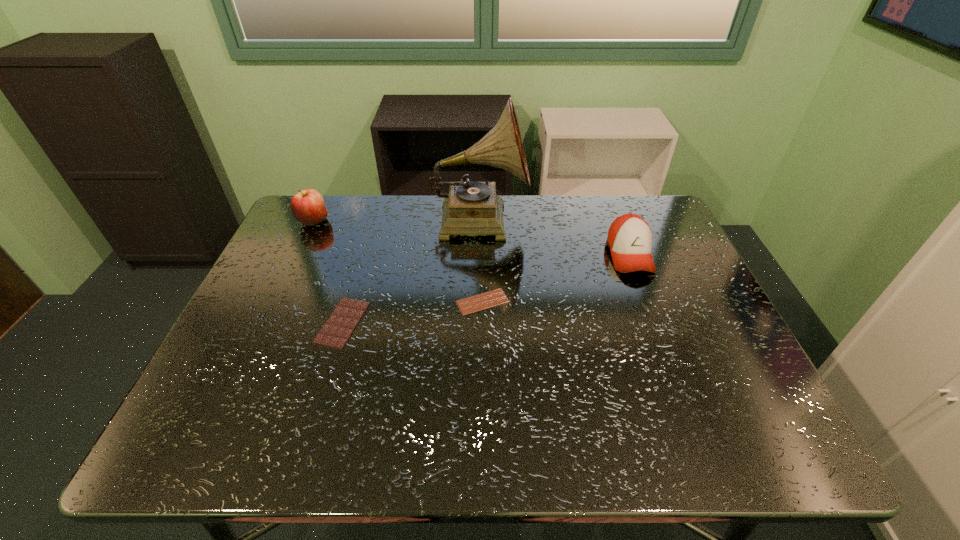
Locate an element on the screen. This screenshot has height=540, width=960. the tallest object is located at coordinates click(x=471, y=208).

Locate an element on the screen. The height and width of the screenshot is (540, 960). apple is located at coordinates (307, 206).

The image size is (960, 540). Find the location of `the rightmost object`. the rightmost object is located at coordinates (629, 239).

This screenshot has height=540, width=960. Find the location of `the fourth tallest object`. the fourth tallest object is located at coordinates (335, 333).

You are a GUI agent. You are given a task and a screenshot of the screen. Output one action in this format:
    pyautogui.click(x=<x>, y=<y>)
    Task: Click on the left chocolate bar
    This screenshot has height=540, width=960.
    Given the screenshot: What is the action you would take?
    pyautogui.click(x=335, y=333)

Locate an element on the screen. The height and width of the screenshot is (540, 960). the right chocolate bar is located at coordinates (496, 297).

The image size is (960, 540). In order to click on the shorter chocolate bar in this screenshot , I will do `click(496, 297)`.

Locate an element on the screen. Image resolution: width=960 pixels, height=540 pixels. vacant space located from the horn of the record player is located at coordinates [622, 219].

Identify the location of vacant space located 0.340m on the front of the apple. (269, 318).

This screenshot has width=960, height=540. I want to click on vacant region located 0.240m on the front-facing side of the rightmost object, so click(667, 354).